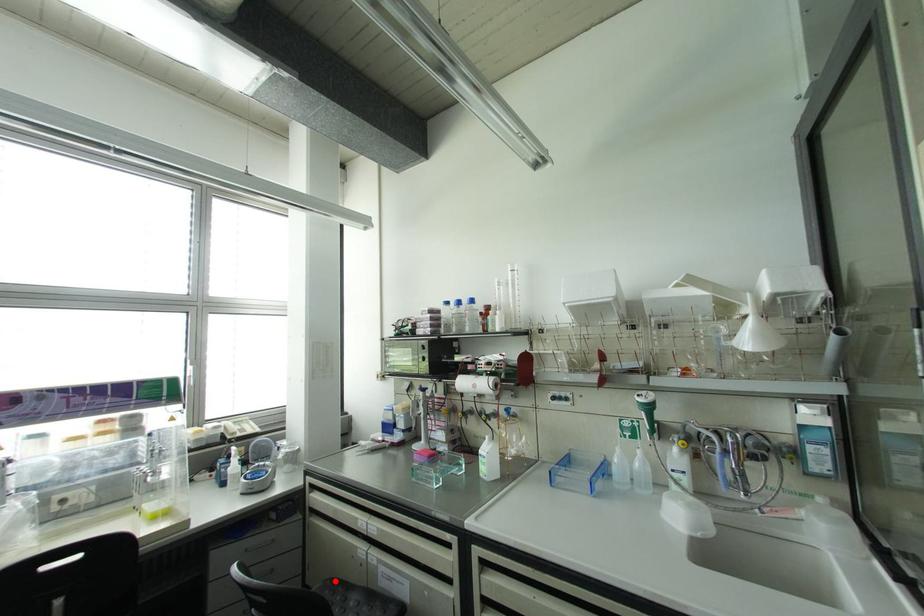
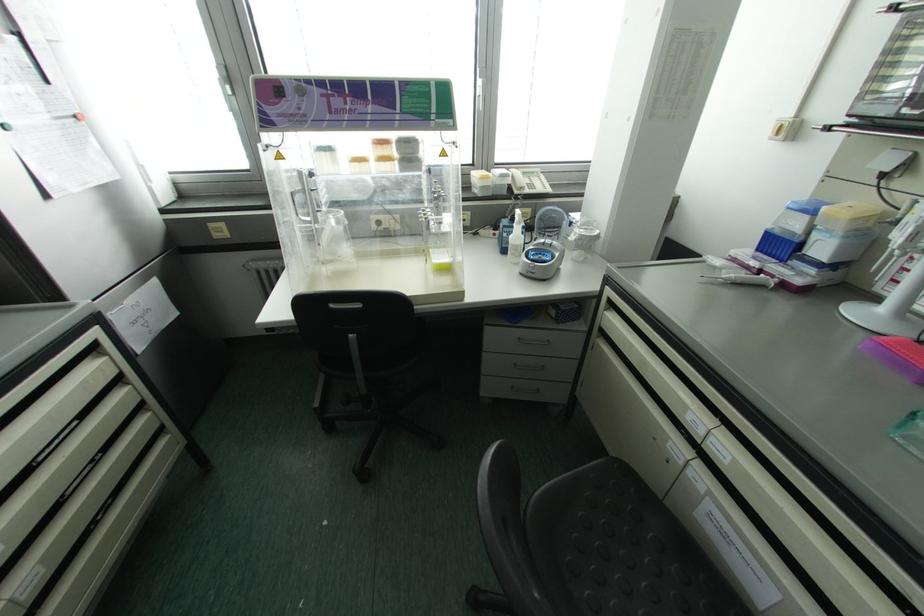
Locate, in the second image, the point that corresponds to the highlighted location in the first image.

(626, 474)